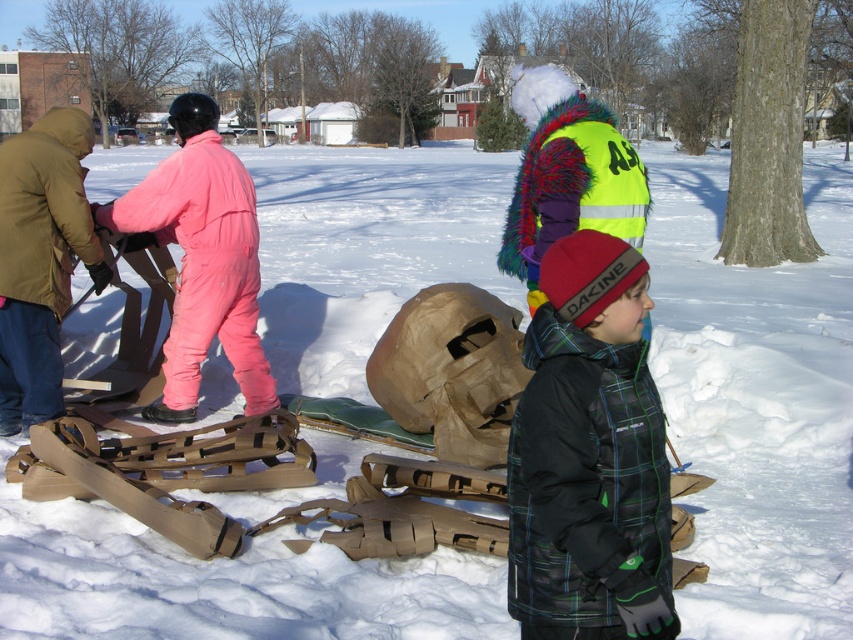
Question: Is black plaid jacket at center thinner than brown leather gloves at left?

Choices:
 (A) no
 (B) yes

Answer: (B)

Question: Estimate the real-world distances between objects in this image. Which object is farther from the pink matte snowsuit at left?

Choices:
 (A) black plaid jacket at center
 (B) brown leather gloves at left

Answer: (A)

Question: Is pink matte snowsuit at left wider than brown leather gloves at left?

Choices:
 (A) no
 (B) yes

Answer: (B)

Question: Which point is closer to the camera?

Choices:
 (A) brown leather gloves at left
 (B) pink matte snowsuit at left
 (C) black plaid jacket at center

Answer: (C)

Question: Is pink matte snowsuit at left closer to camera compared to brown leather gloves at left?

Choices:
 (A) yes
 (B) no

Answer: (B)

Question: Estimate the real-world distances between objects in this image. Which object is farther from the brown leather gloves at left?

Choices:
 (A) pink matte snowsuit at left
 (B) black plaid jacket at center

Answer: (B)